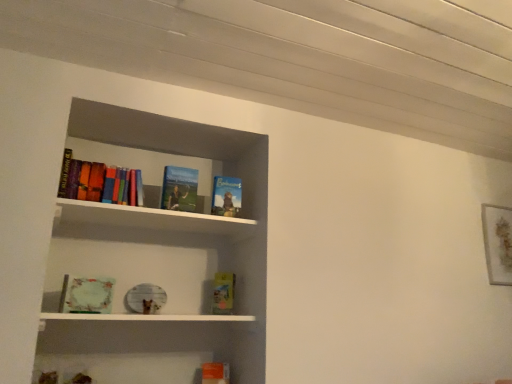
At what (x,y) coordinates should I click in order to perform the action: click on hardcover book at upper center, which appears as the fifth book when ordered from the bottom. Please return your answer as a coordinate pair (x, y). Looking at the image, I should click on (179, 189).

What do you see at coordinates (100, 182) in the screenshot? This screenshot has height=384, width=512. I see `multicolored hardcover books at upper left, the first book when ordered from top to bottom` at bounding box center [100, 182].

This screenshot has height=384, width=512. Describe the element at coordinates (86, 295) in the screenshot. I see `matte green book at lower left, acting as the 4th book starting from the top` at that location.

Find the location of a particular element. This screenshot has height=384, width=512. hardcover book at center, the fifth book viewed from the top is located at coordinates (223, 293).

Is hardcover book at upper center, marked as the second book in a top-to-bottom arrangement, at the left side of matte green book at lower left, which ranks as the 3th book in bottom-to-top order?

Incorrect, hardcover book at upper center, marked as the second book in a top-to-bottom arrangement, is not on the left side of matte green book at lower left, which ranks as the 3th book in bottom-to-top order.

Between hardcover book at upper center, marked as the second book in a top-to-bottom arrangement, and matte green book at lower left, acting as the 4th book starting from the top, which one has larger size?

With larger size is hardcover book at upper center, marked as the second book in a top-to-bottom arrangement.

Which object is further away from the camera, hardcover book at upper center, marked as the second book in a top-to-bottom arrangement, or matte green book at lower left, which ranks as the 3th book in bottom-to-top order?

hardcover book at upper center, marked as the second book in a top-to-bottom arrangement.

From a real-world perspective, is hardcover book at upper center, which appears as the fifth book when ordered from the bottom, under multicolored hardcover books at upper left, the sixth book ordered from the bottom?

Actually, hardcover book at upper center, which appears as the fifth book when ordered from the bottom, is physically above multicolored hardcover books at upper left, the sixth book ordered from the bottom, in the real world.

Where is `book that is the 1st one when counting leftward from the hardcover book at upper center, which appears as the fifth book when ordered from the bottom`? The height and width of the screenshot is (384, 512). book that is the 1st one when counting leftward from the hardcover book at upper center, which appears as the fifth book when ordered from the bottom is located at coordinates (100, 182).

Can you confirm if hardcover book at upper center, marked as the second book in a top-to-bottom arrangement, is wider than multicolored hardcover books at upper left, the first book when ordered from top to bottom?

No.

In the scene shown: Which object is further away from the camera taking this photo, hardcover book at upper center, which appears as the fifth book when ordered from the bottom, or multicolored hardcover books at upper left, the sixth book ordered from the bottom?

hardcover book at upper center, which appears as the fifth book when ordered from the bottom, is behind.

Considering the relative sizes of hardcover book at upper center, marked as the second book in a top-to-bottom arrangement, and orange matte book at lower center, the 1th book ordered from the bottom, in the image provided, is hardcover book at upper center, marked as the second book in a top-to-bottom arrangement, thinner than orange matte book at lower center, the 1th book ordered from the bottom,?

Indeed, hardcover book at upper center, marked as the second book in a top-to-bottom arrangement, has a lesser width compared to orange matte book at lower center, the 1th book ordered from the bottom.

Which object is further away from the camera, hardcover book at upper center, which appears as the fifth book when ordered from the bottom, or orange matte book at lower center, the 1th book ordered from the bottom?

orange matte book at lower center, the 1th book ordered from the bottom, is further away from the camera.

Is hardcover book at upper center, which appears as the fifth book when ordered from the bottom, not inside orange matte book at lower center, positioned as the sixth book in top-to-bottom order?

Yes, hardcover book at upper center, which appears as the fifth book when ordered from the bottom, is not within orange matte book at lower center, positioned as the sixth book in top-to-bottom order.

Is hardcover book at upper center, which appears as the fifth book when ordered from the bottom, far away from orange matte book at lower center, the 1th book ordered from the bottom?

That's not correct — hardcover book at upper center, which appears as the fifth book when ordered from the bottom, is a little close to orange matte book at lower center, the 1th book ordered from the bottom.

Considering the sizes of objects hardcover book at center, marked as the 2th book in a bottom-to-top arrangement, and orange matte book at lower center, the 1th book ordered from the bottom, in the image provided, who is smaller, hardcover book at center, marked as the 2th book in a bottom-to-top arrangement, or orange matte book at lower center, the 1th book ordered from the bottom,?

With smaller size is hardcover book at center, marked as the 2th book in a bottom-to-top arrangement.

How many degrees apart are the facing directions of hardcover book at center, marked as the 2th book in a bottom-to-top arrangement, and orange matte book at lower center, the 1th book ordered from the bottom?

There is a 17.9-degree angle between the facing directions of hardcover book at center, marked as the 2th book in a bottom-to-top arrangement, and orange matte book at lower center, the 1th book ordered from the bottom.

Does hardcover book at center, the fifth book viewed from the top, have a lesser height compared to orange matte book at lower center, the 1th book ordered from the bottom?

Incorrect, the height of hardcover book at center, the fifth book viewed from the top, does not fall short of that of orange matte book at lower center, the 1th book ordered from the bottom.

The image size is (512, 384). I want to click on the 4th book to the left of the hardcover book at center, the fifth book viewed from the top, counting from the anchor's position, so click(x=86, y=295).

From the picture: From the image's perspective, is matte green book at lower left, which ranks as the 3th book in bottom-to-top order, above hardcover book at center, marked as the 2th book in a bottom-to-top arrangement?

Yes, from the image's perspective, matte green book at lower left, which ranks as the 3th book in bottom-to-top order, is above hardcover book at center, marked as the 2th book in a bottom-to-top arrangement.

From a real-world perspective, is matte green book at lower left, acting as the 4th book starting from the top, located beneath hardcover book at center, the fifth book viewed from the top?

Correct, in the physical world, matte green book at lower left, acting as the 4th book starting from the top, is lower than hardcover book at center, the fifth book viewed from the top.

Is matte green book at lower left, acting as the 4th book starting from the top, next to hardcover book at upper center, which appears as the fifth book when ordered from the bottom, and touching it?

No, matte green book at lower left, acting as the 4th book starting from the top, is not making contact with hardcover book at upper center, which appears as the fifth book when ordered from the bottom.

From a real-world perspective, is matte green book at lower left, acting as the 4th book starting from the top, positioned under hardcover book at upper center, which appears as the fifth book when ordered from the bottom, based on gravity?

Yes, from a real-world perspective, matte green book at lower left, acting as the 4th book starting from the top, is beneath hardcover book at upper center, which appears as the fifth book when ordered from the bottom.

In terms of width, does matte green book at lower left, which ranks as the 3th book in bottom-to-top order, look wider or thinner when compared to hardcover book at upper center, marked as the second book in a top-to-bottom arrangement?

Clearly, matte green book at lower left, which ranks as the 3th book in bottom-to-top order, has less width compared to hardcover book at upper center, marked as the second book in a top-to-bottom arrangement.

Is matte green book at lower left, acting as the 4th book starting from the top, outside of hardcover book at upper center, marked as the second book in a top-to-bottom arrangement?

Yes, matte green book at lower left, acting as the 4th book starting from the top, is outside of hardcover book at upper center, marked as the second book in a top-to-bottom arrangement.

Based on their positions, is orange matte book at lower center, positioned as the sixth book in top-to-bottom order, located to the left or right of multicolored hardcover books at upper left, the first book when ordered from top to bottom?

Clearly, orange matte book at lower center, positioned as the sixth book in top-to-bottom order, is on the right of multicolored hardcover books at upper left, the first book when ordered from top to bottom, in the image.

Between orange matte book at lower center, positioned as the sixth book in top-to-bottom order, and multicolored hardcover books at upper left, the sixth book ordered from the bottom, which one has smaller width?

Thinner between the two is multicolored hardcover books at upper left, the sixth book ordered from the bottom.

From the image's perspective, which one is positioned lower, orange matte book at lower center, the 1th book ordered from the bottom, or multicolored hardcover books at upper left, the sixth book ordered from the bottom?

orange matte book at lower center, the 1th book ordered from the bottom, is shown below in the image.

Between orange matte book at lower center, the 1th book ordered from the bottom, and multicolored hardcover books at upper left, the first book when ordered from top to bottom, which one has larger size?

Bigger between the two is multicolored hardcover books at upper left, the first book when ordered from top to bottom.

The width and height of the screenshot is (512, 384). In order to click on the 4th book located beneath the hardcover book at upper center, marked as the second book in a top-to-bottom arrangement (from a real-world perspective) in this screenshot , I will do `click(86, 295)`.

Where is `the 1st book behind the multicolored hardcover books at upper left, the sixth book ordered from the bottom`? The height and width of the screenshot is (384, 512). the 1st book behind the multicolored hardcover books at upper left, the sixth book ordered from the bottom is located at coordinates (179, 189).

Based on their spatial positions, is hardcover book at center, marked as the 2th book in a bottom-to-top arrangement, or hardcover book at upper center, arranged as the 4th book when ordered from the bottom, closer to orange matte book at lower center, positioned as the sixth book in top-to-bottom order?

Based on the image, hardcover book at center, marked as the 2th book in a bottom-to-top arrangement, appears to be nearer to orange matte book at lower center, positioned as the sixth book in top-to-bottom order.

Considering their positions, is hardcover book at upper center, which appears as the fifth book when ordered from the bottom, positioned closer to matte green book at lower left, which ranks as the 3th book in bottom-to-top order, than hardcover book at upper center, acting as the 3th book starting from the top?

hardcover book at upper center, which appears as the fifth book when ordered from the bottom, is positioned closer to the anchor matte green book at lower left, which ranks as the 3th book in bottom-to-top order.

Considering their positions, is multicolored hardcover books at upper left, the first book when ordered from top to bottom, positioned closer to orange matte book at lower center, the 1th book ordered from the bottom, than hardcover book at upper center, acting as the 3th book starting from the top?

hardcover book at upper center, acting as the 3th book starting from the top, is positioned closer to the anchor orange matte book at lower center, the 1th book ordered from the bottom.

Considering their positions, is hardcover book at upper center, acting as the 3th book starting from the top, positioned further to matte green book at lower left, acting as the 4th book starting from the top, than hardcover book at center, the fifth book viewed from the top?

Among the two, hardcover book at upper center, acting as the 3th book starting from the top, is located further to matte green book at lower left, acting as the 4th book starting from the top.

Based on the photo, looking at the image, which one is located further to hardcover book at upper center, acting as the 3th book starting from the top, orange matte book at lower center, positioned as the sixth book in top-to-bottom order, or hardcover book at center, the fifth book viewed from the top?

The object further to hardcover book at upper center, acting as the 3th book starting from the top, is orange matte book at lower center, positioned as the sixth book in top-to-bottom order.

Considering their positions, is matte green book at lower left, acting as the 4th book starting from the top, positioned further to hardcover book at upper center, marked as the second book in a top-to-bottom arrangement, than hardcover book at center, the fifth book viewed from the top?

matte green book at lower left, acting as the 4th book starting from the top.

From the image, which object appears to be nearer to hardcover book at upper center, acting as the 3th book starting from the top, hardcover book at upper center, marked as the second book in a top-to-bottom arrangement, or orange matte book at lower center, the 1th book ordered from the bottom?

hardcover book at upper center, marked as the second book in a top-to-bottom arrangement.

Considering their positions, is orange matte book at lower center, positioned as the sixth book in top-to-bottom order, positioned closer to hardcover book at upper center, acting as the 3th book starting from the top, than multicolored hardcover books at upper left, the sixth book ordered from the bottom?

multicolored hardcover books at upper left, the sixth book ordered from the bottom, is closer to hardcover book at upper center, acting as the 3th book starting from the top.